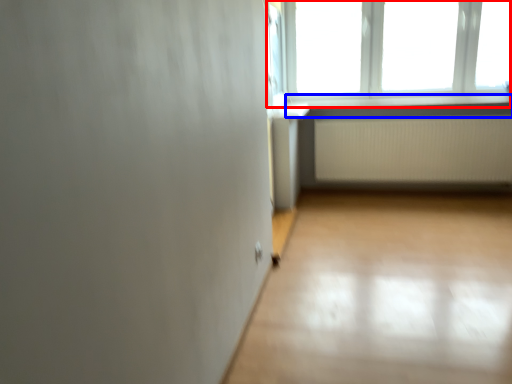
Question: Which object is further to the camera taking this photo, window (highlighted by a red box) or window sill (highlighted by a blue box)?

Choices:
 (A) window
 (B) window sill

Answer: (B)